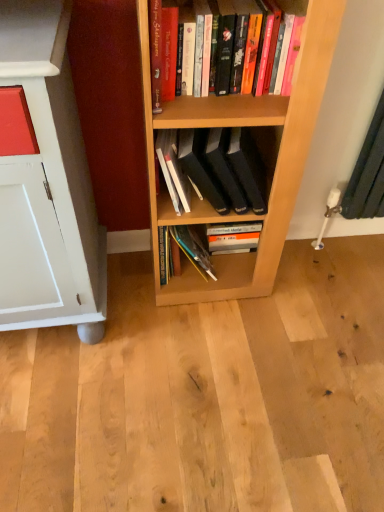
Measure the distance between black matte book at center, the 1th book when ordered from bottom to top, and camera.

black matte book at center, the 1th book when ordered from bottom to top, and camera are 3.88 feet apart from each other.

I want to click on black matte book at center, acting as the 2th book starting from the top, so click(224, 168).

What do you see at coordinates (224, 168) in the screenshot? This screenshot has width=384, height=512. I see `black matte book at center, acting as the 2th book starting from the top` at bounding box center [224, 168].

The width and height of the screenshot is (384, 512). Identify the location of hardcover books at upper center, the first book when ordered from top to bottom. (290, 5).

Describe the element at coordinates (290, 5) in the screenshot. The width and height of the screenshot is (384, 512). I see `hardcover books at upper center, the second book from the bottom` at that location.

Where is `black matte book at center, the 1th book when ordered from bottom to top`? Image resolution: width=384 pixels, height=512 pixels. black matte book at center, the 1th book when ordered from bottom to top is located at coordinates (224, 168).

Is hardcover books at upper center, the second book from the bottom, to the left of black matte book at center, the 1th book when ordered from bottom to top, from the viewer's perspective?

No, hardcover books at upper center, the second book from the bottom, is not to the left of black matte book at center, the 1th book when ordered from bottom to top.

Relative to black matte book at center, acting as the 2th book starting from the top, is hardcover books at upper center, the second book from the bottom, in front or behind?

Clearly, hardcover books at upper center, the second book from the bottom, is in front of black matte book at center, acting as the 2th book starting from the top.

Does point (297, 4) appear closer or farther from the camera than point (217, 191)?

Point (297, 4) appears to be closer to the viewer than point (217, 191).

From the image's perspective, between hardcover books at upper center, the second book from the bottom, and black matte book at center, acting as the 2th book starting from the top, who is located below?

black matte book at center, acting as the 2th book starting from the top, from the image's perspective.

From a real-world perspective, between hardcover books at upper center, the first book when ordered from top to bottom, and black matte book at center, the 1th book when ordered from bottom to top, who is vertically lower?

black matte book at center, the 1th book when ordered from bottom to top.

In terms of width, does hardcover books at upper center, the first book when ordered from top to bottom, look wider or thinner when compared to black matte book at center, the 1th book when ordered from bottom to top?

hardcover books at upper center, the first book when ordered from top to bottom, is thinner than black matte book at center, the 1th book when ordered from bottom to top.

Can you confirm if hardcover books at upper center, the second book from the bottom, is shorter than black matte book at center, the 1th book when ordered from bottom to top?

Yes, hardcover books at upper center, the second book from the bottom, is shorter than black matte book at center, the 1th book when ordered from bottom to top.

Which of these two, hardcover books at upper center, the first book when ordered from top to bottom, or black matte book at center, the 1th book when ordered from bottom to top, is smaller?

Smaller between the two is hardcover books at upper center, the first book when ordered from top to bottom.

Is hardcover books at upper center, the second book from the bottom, situated inside black matte book at center, acting as the 2th book starting from the top, or outside?

hardcover books at upper center, the second book from the bottom, is located beyond the bounds of black matte book at center, acting as the 2th book starting from the top.

Is hardcover books at upper center, the first book when ordered from top to bottom, positioned far away from black matte book at center, the 1th book when ordered from bottom to top?

No.

Could you tell me if hardcover books at upper center, the first book when ordered from top to bottom, is facing black matte book at center, acting as the 2th book starting from the top?

No, hardcover books at upper center, the first book when ordered from top to bottom, is not oriented towards black matte book at center, acting as the 2th book starting from the top.

How different are the orientations of hardcover books at upper center, the first book when ordered from top to bottom, and black matte book at center, acting as the 2th book starting from the top, in degrees?

0.000591 degrees separate the facing orientations of hardcover books at upper center, the first book when ordered from top to bottom, and black matte book at center, acting as the 2th book starting from the top.

Measure the distance between hardcover books at upper center, the first book when ordered from top to bottom, and black matte book at center, acting as the 2th book starting from the top.

A distance of 10.98 inches exists between hardcover books at upper center, the first book when ordered from top to bottom, and black matte book at center, acting as the 2th book starting from the top.

Find the location of `book on the right of black matte book at center, acting as the 2th book starting from the top`. book on the right of black matte book at center, acting as the 2th book starting from the top is located at coordinates (290, 5).

Considering the relative positions of black matte book at center, the 1th book when ordered from bottom to top, and hardcover books at upper center, the first book when ordered from top to bottom, in the image provided, is black matte book at center, the 1th book when ordered from bottom to top, to the left or to the right of hardcover books at upper center, the first book when ordered from top to bottom,?

Clearly, black matte book at center, the 1th book when ordered from bottom to top, is on the left of hardcover books at upper center, the first book when ordered from top to bottom, in the image.

Which object is more forward, black matte book at center, the 1th book when ordered from bottom to top, or hardcover books at upper center, the second book from the bottom?

hardcover books at upper center, the second book from the bottom, is more forward.

Does point (202, 180) come farther from viewer compared to point (261, 66)?

Yes, it is behind point (261, 66).

From the image's perspective, which one is positioned lower, black matte book at center, acting as the 2th book starting from the top, or hardcover books at upper center, the second book from the bottom?

black matte book at center, acting as the 2th book starting from the top, from the image's perspective.

From a real-world perspective, which object stands above the other?

In real-world perspective, hardcover books at upper center, the first book when ordered from top to bottom, is above.

Looking at their sizes, would you say black matte book at center, acting as the 2th book starting from the top, is wider or thinner than hardcover books at upper center, the second book from the bottom?

In the image, black matte book at center, acting as the 2th book starting from the top, appears to be wider than hardcover books at upper center, the second book from the bottom.

Considering the sizes of objects black matte book at center, acting as the 2th book starting from the top, and hardcover books at upper center, the first book when ordered from top to bottom, in the image provided, who is taller, black matte book at center, acting as the 2th book starting from the top, or hardcover books at upper center, the first book when ordered from top to bottom,?

Standing taller between the two is black matte book at center, acting as the 2th book starting from the top.

Can you confirm if black matte book at center, the 1th book when ordered from bottom to top, is bigger than hardcover books at upper center, the second book from the bottom?

Yes.

Does black matte book at center, acting as the 2th book starting from the top, contain hardcover books at upper center, the second book from the bottom?

No, hardcover books at upper center, the second book from the bottom, is not a part of black matte book at center, acting as the 2th book starting from the top.

Is black matte book at center, acting as the 2th book starting from the top, oriented away from hardcover books at upper center, the second book from the bottom?

No, black matte book at center, acting as the 2th book starting from the top,'s orientation is not away from hardcover books at upper center, the second book from the bottom.

How different are the orientations of black matte book at center, acting as the 2th book starting from the top, and hardcover books at upper center, the second book from the bottom, in degrees?

The angular difference between black matte book at center, acting as the 2th book starting from the top, and hardcover books at upper center, the second book from the bottom, is 0.000591 degrees.

Measure the distance from black matte book at center, acting as the 2th book starting from the top, to hardcover books at upper center, the first book when ordered from top to bottom.

10.98 inches.

Locate an element on the screen. Image resolution: width=384 pixels, height=512 pixels. book below the hardcover books at upper center, the first book when ordered from top to bottom (from the image's perspective) is located at coordinates (224, 168).

I want to click on book above the black matte book at center, the 1th book when ordered from bottom to top (from the image's perspective), so click(x=290, y=5).

I want to click on book on the right of black matte book at center, acting as the 2th book starting from the top, so click(x=290, y=5).